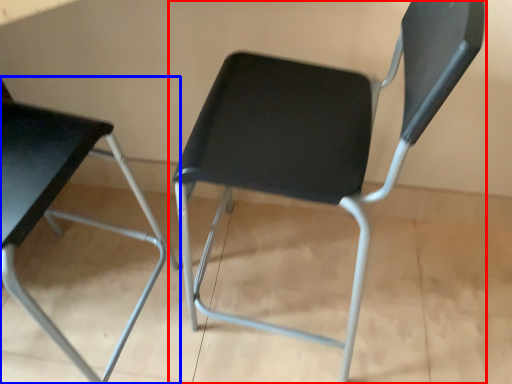
Question: Which object appears farthest to the camera in this image, chair (highlighted by a red box) or chair (highlighted by a blue box)?

Choices:
 (A) chair
 (B) chair

Answer: (A)